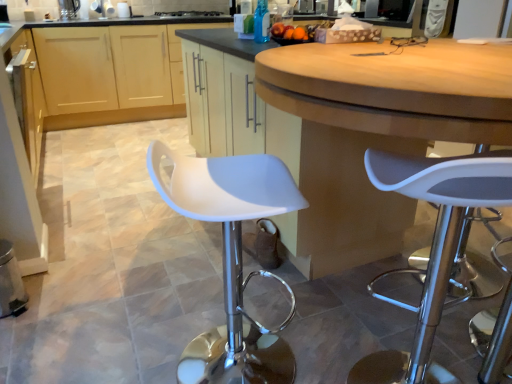
The image size is (512, 384). What are the coordinates of `free spot to the right of white plastic stool at center` in the screenshot? It's located at (323, 337).